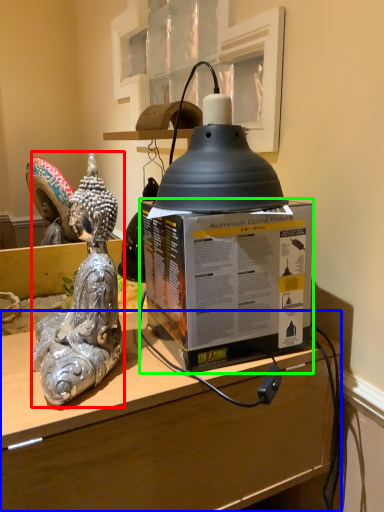
Question: Which object is positioned closest to figurine (highlighted by a red box)? Select from desk (highlighted by a blue box) and box (highlighted by a green box).

Choices:
 (A) desk
 (B) box

Answer: (B)